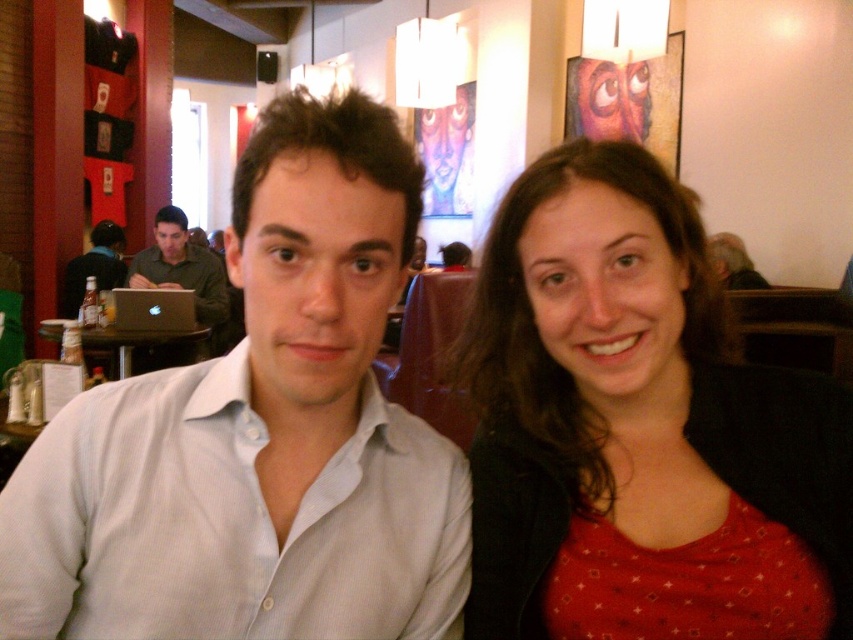
Question: Which point is closer to the camera?

Choices:
 (A) matte black laptop at left
 (B) red matte shirt at center
 (C) white shirt at center
 (D) green matte shirt at left

Answer: (C)

Question: Can you confirm if white shirt at center is smaller than red matte shirt at center?

Choices:
 (A) no
 (B) yes

Answer: (B)

Question: Observing the image, what is the correct spatial positioning of white shirt at center in reference to green matte shirt at left?

Choices:
 (A) right
 (B) left

Answer: (A)

Question: Based on their relative distances, which object is farther from the red matte shirt at center?

Choices:
 (A) white shirt at center
 (B) black plastic table at left

Answer: (B)

Question: Is matte black laptop at left positioned in front of black plastic table at left?

Choices:
 (A) no
 (B) yes

Answer: (A)

Question: Which of these objects is positioned closest to the red matte shirt at center?

Choices:
 (A) white shirt at center
 (B) matte black laptop at left
 (C) green matte shirt at left
 (D) black plastic table at left

Answer: (A)